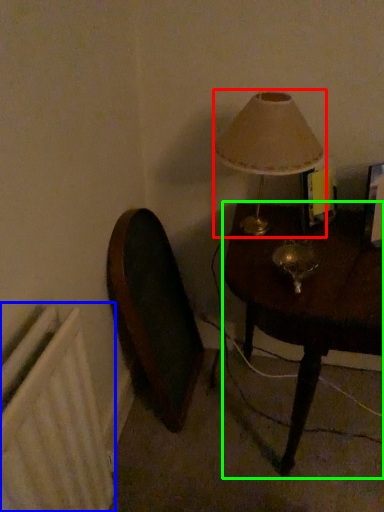
Question: Estimate the real-world distances between objects in this image. Which object is farther from lamp (highlighted by a red box), radiator (highlighted by a blue box) or table (highlighted by a green box)?

Choices:
 (A) radiator
 (B) table

Answer: (A)